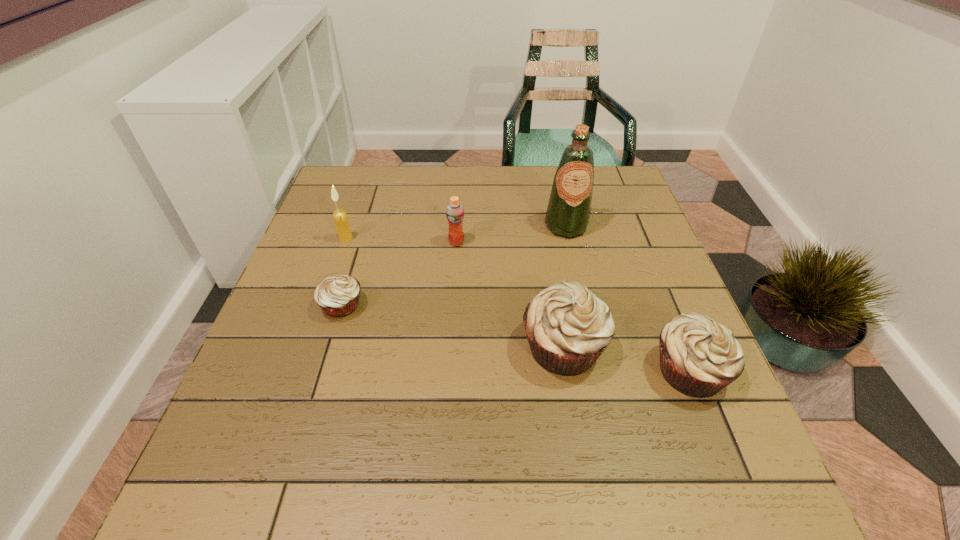
At what (x,y) coordinates should I click in order to perform the action: click on the shortest object. Please return your answer as a coordinate pair (x, y). Image resolution: width=960 pixels, height=540 pixels. Looking at the image, I should click on (338, 296).

What are the coordinates of `the shortest muffin` in the screenshot? It's located at (338, 296).

Identify the location of the second muffin from right to left. The width and height of the screenshot is (960, 540). (568, 328).

Where is `the second shortest object`? the second shortest object is located at coordinates (698, 357).

The height and width of the screenshot is (540, 960). In order to click on the rightmost object in this screenshot , I will do `click(698, 357)`.

You are a GUI agent. You are given a task and a screenshot of the screen. Output one action in this format:
    pyautogui.click(x=<x>, y=<y>)
    Task: Click on the olive oil
    The height and width of the screenshot is (540, 960).
    Given the screenshot: What is the action you would take?
    pyautogui.click(x=568, y=212)

Locate an element on the screen. The width and height of the screenshot is (960, 540). the fifth shortest object is located at coordinates (340, 217).

Where is `orange juice`? The height and width of the screenshot is (540, 960). orange juice is located at coordinates pyautogui.click(x=454, y=212).

Image resolution: width=960 pixels, height=540 pixels. What are the coordinates of `vacant area located on the right of the shortest muffin` in the screenshot? It's located at (441, 305).

Identify the location of free space located 0.240m on the back of the second muffin from left to right. Image resolution: width=960 pixels, height=540 pixels. (546, 244).